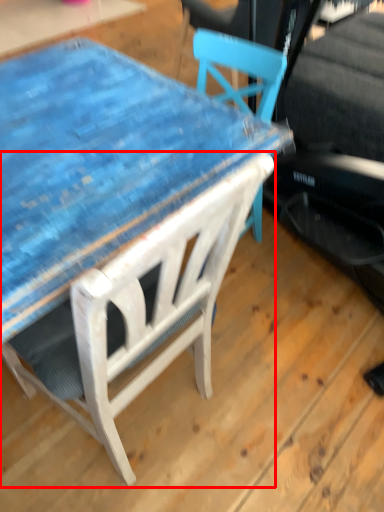
Question: From the image, what is the correct spatial relationship of chair (annotated by the red box) in relation to table?

Choices:
 (A) right
 (B) left

Answer: (B)